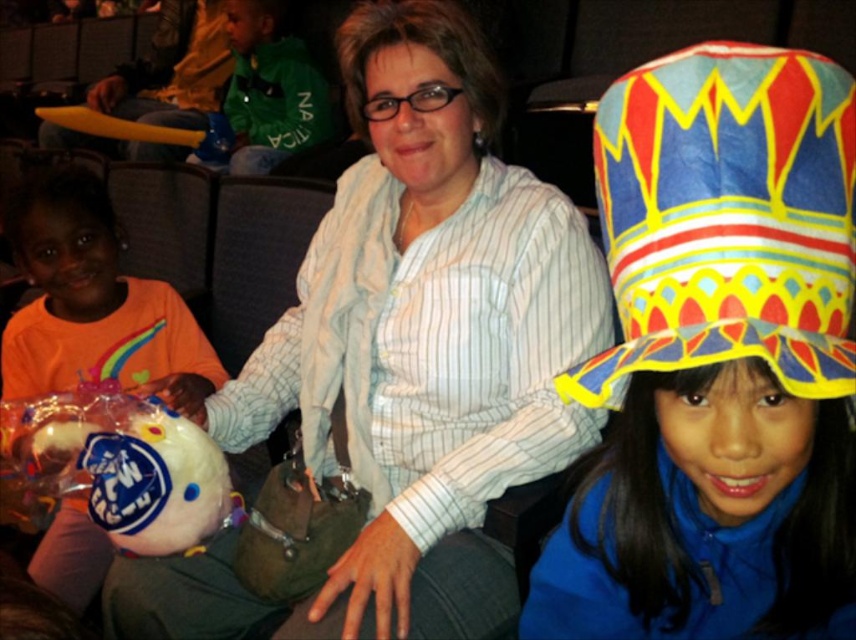
You are a photographer setting up for a group photo in the auditorium. You need to ensure that the white striped shirt at center and the paper crown at upper right are both visible in the frame. Based on their sizes, which object will appear larger in the final photo?

The white striped shirt at center will appear larger in the final photo because it is taller than the paper crown at upper right.

You are organizing a party and need to decide where to place the paper crown at upper right and the orange fabric plush toy at left. Based on their sizes, which item should be placed on the smaller shelf and which on the larger shelf?

The paper crown at upper right is smaller than the orange fabric plush toy at left, so the paper crown at upper right should be placed on the smaller shelf and the orange fabric plush toy at left on the larger shelf.

You are a photographer trying to capture a clear photo of the white striped shirt at center and the orange fabric plush toy at left. Which object should you focus on first if you want to ensure both are in focus?

The white striped shirt at center is larger in size than the orange fabric plush toy at left, so you should focus on the white striped shirt at center first to ensure both are in focus.